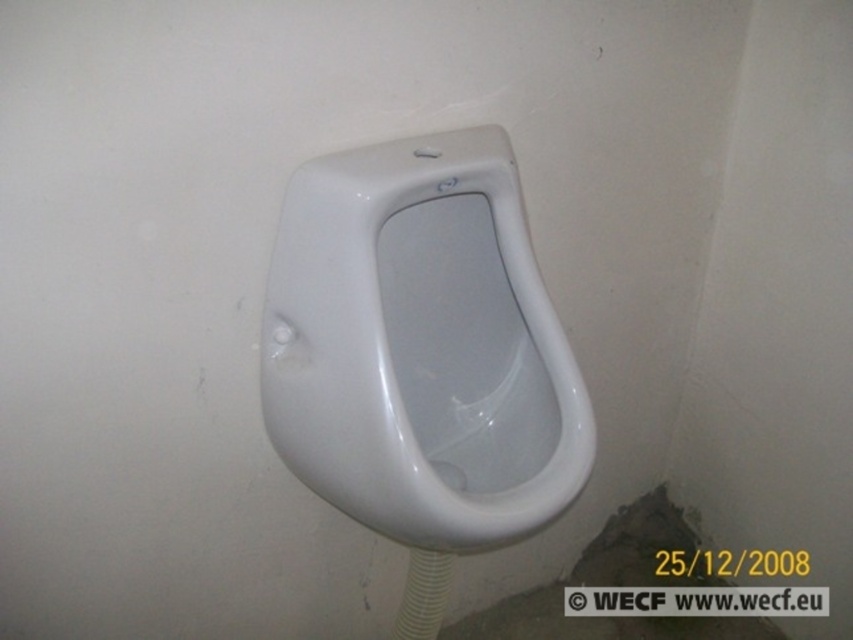
Does white glossy urinal at center appear under white rubber pipe at lower center?

No.

The height and width of the screenshot is (640, 853). Describe the element at coordinates (421, 346) in the screenshot. I see `white glossy urinal at center` at that location.

This screenshot has width=853, height=640. Identify the location of white glossy urinal at center. (421, 346).